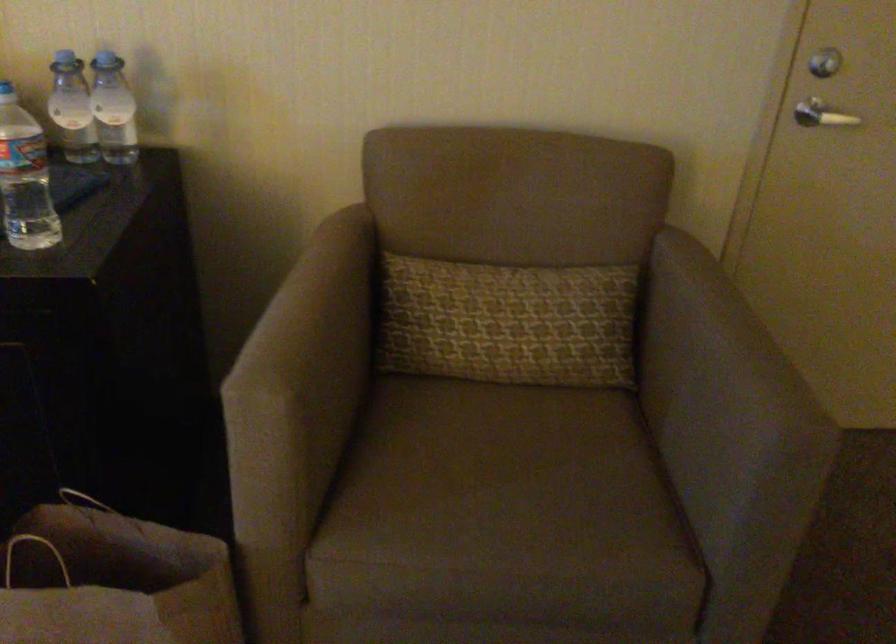
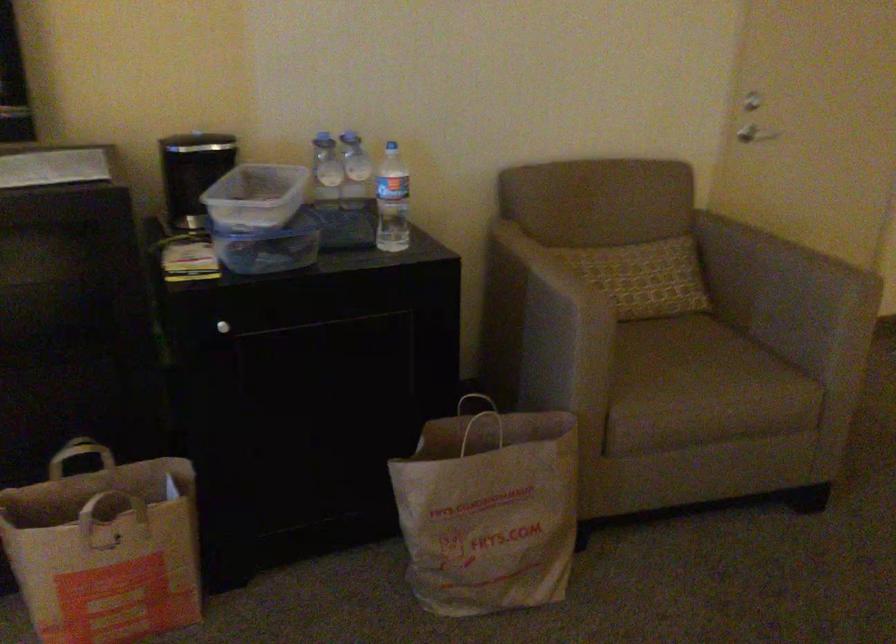
Find the pixel in the second image that matches point (698, 342) in the first image.

(767, 259)